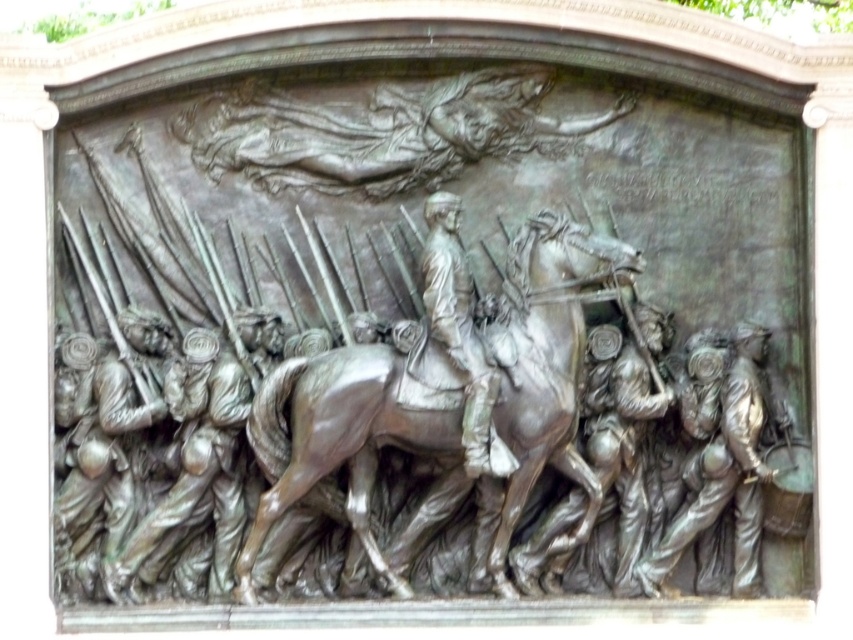
Consider the image. Based on the scene description, which object is located below the other? The shiny bronze horse at center or the bronze figure at center?

The shiny bronze horse at center is positioned under the bronze figure at center.

Based on the coordinates provided in the description, where is the shiny bronze horse at center located in the bronze relief sculpture?

The shiny bronze horse at center is located at point coordinates of (352, 433).